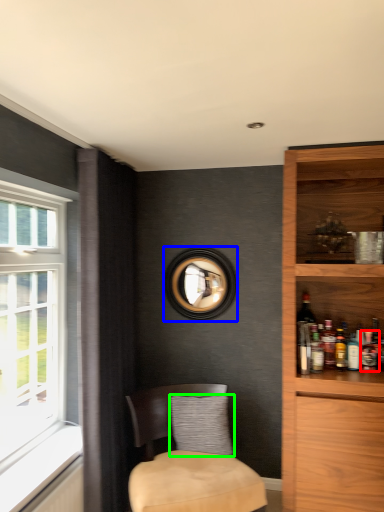
Question: Estimate the real-world distances between objects in this image. Which object is farther from beverage (highlighted by a red box), picture frame (highlighted by a blue box) or pillow (highlighted by a green box)?

Choices:
 (A) picture frame
 (B) pillow

Answer: (A)